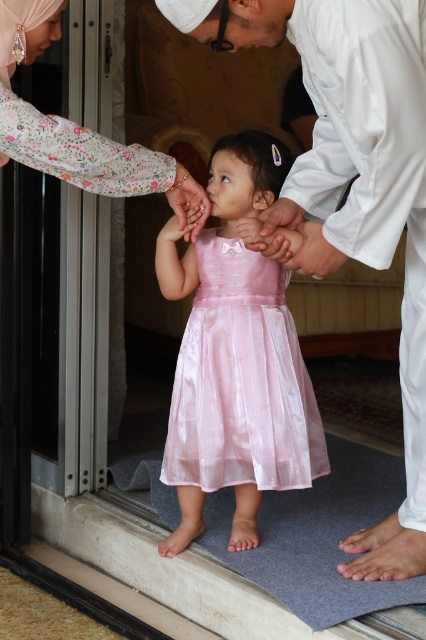
You are standing in the same room as the white satin shirt at center. If you want to hand a small gift to someone standing 5 feet away from you, can you reach them without moving? Explain your answer using the distance given.

The distance between you and the viewer is 4.57 feet, which is less than 5 feet. Therefore, you cannot reach the person 5 feet away without moving closer.

Please describe the location of the floral fabric hand at upper left in the image using coordinates. The scene includes a young child in a pink dress standing on a gray mat near a doorway, being held by two adults, one in floral attire on the left and another in white on the right.

The floral fabric hand at upper left is located at coordinates point (78,129).